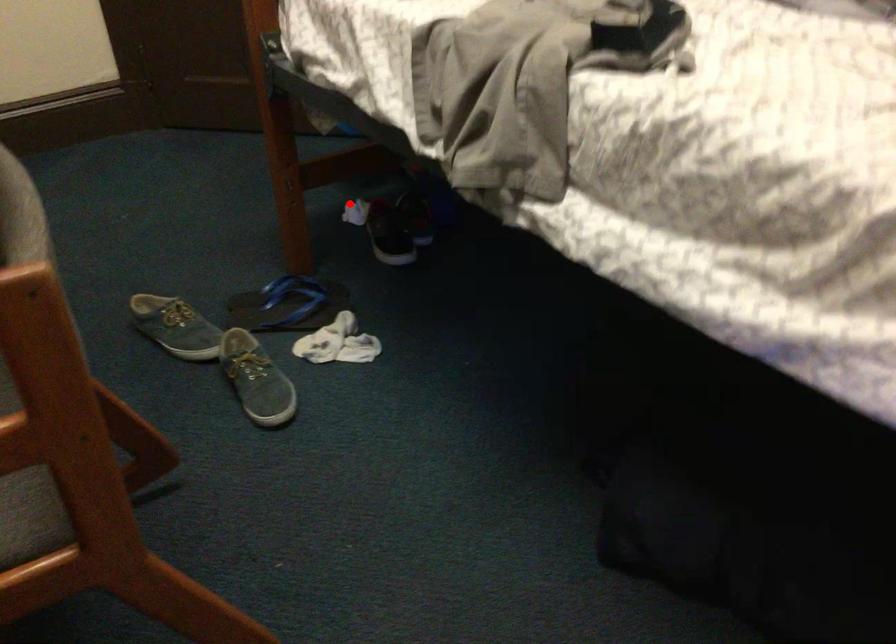
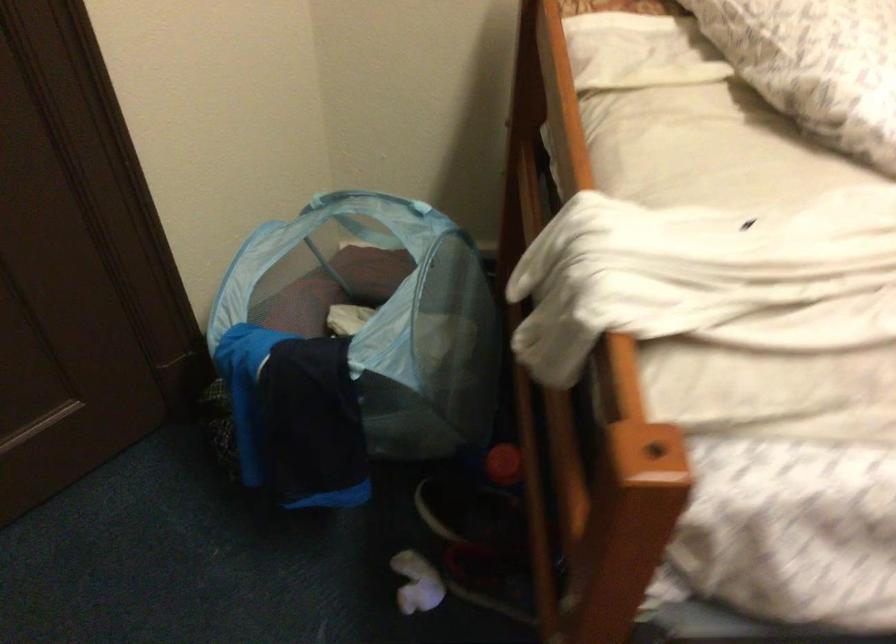
Find the pixel in the second image that matches the highlighted location in the first image.

(417, 583)